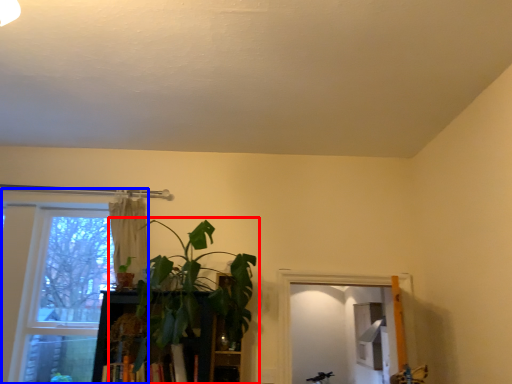
Question: Which object is further to the camera taking this photo, houseplant (highlighted by a red box) or window (highlighted by a blue box)?

Choices:
 (A) houseplant
 (B) window

Answer: (B)